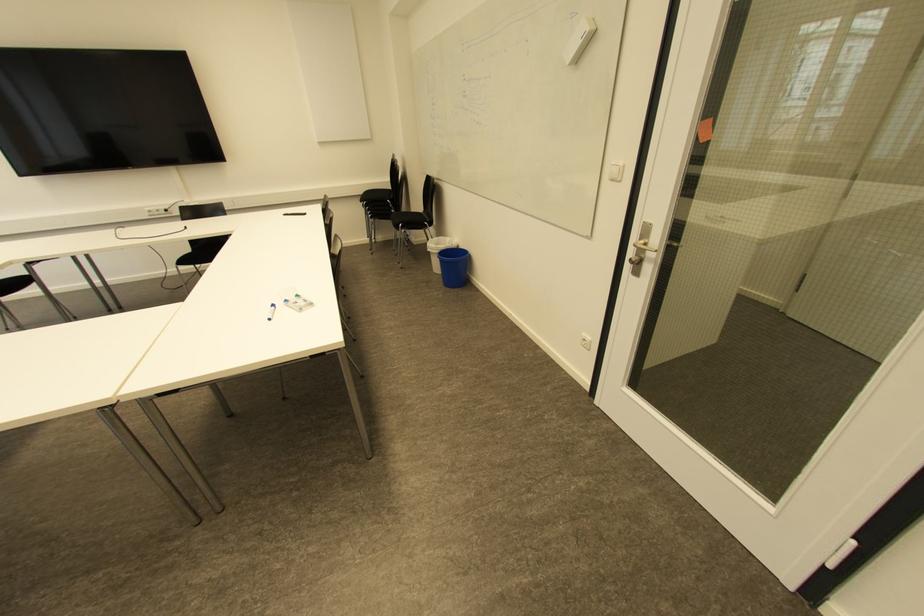
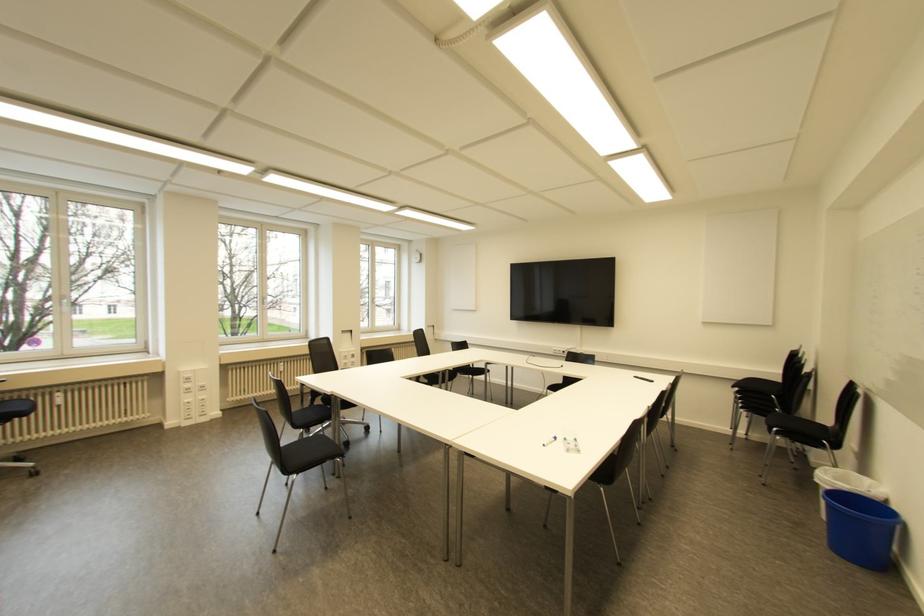
Question: How did the camera likely rotate?

Choices:
 (A) Left
 (B) Right
 (C) Up
 (D) Down

Answer: (A)